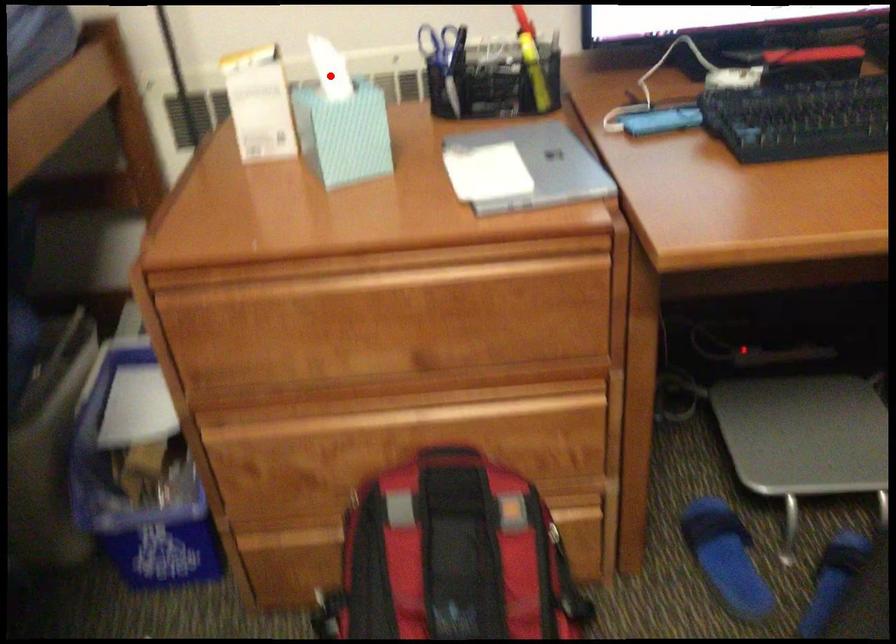
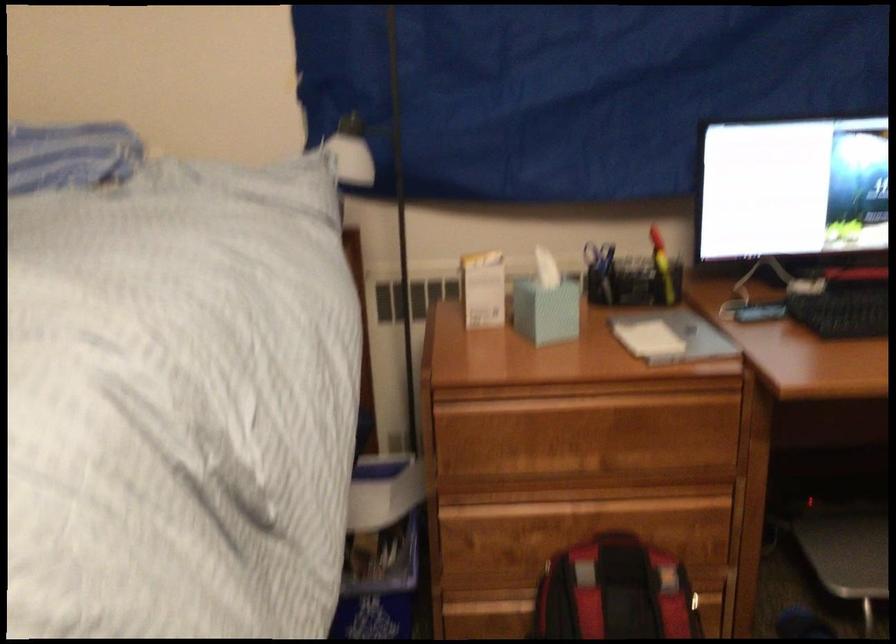
In the second image, find the point that corresponds to the highlighted location in the first image.

(545, 270)